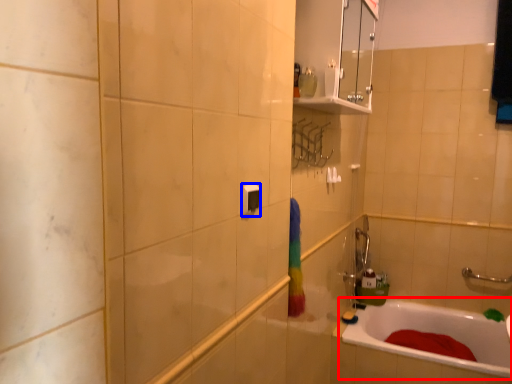
Question: Among these objects, which one is farthest to the camera, bathtub (highlighted by a red box) or light switch (highlighted by a blue box)?

Choices:
 (A) bathtub
 (B) light switch

Answer: (A)